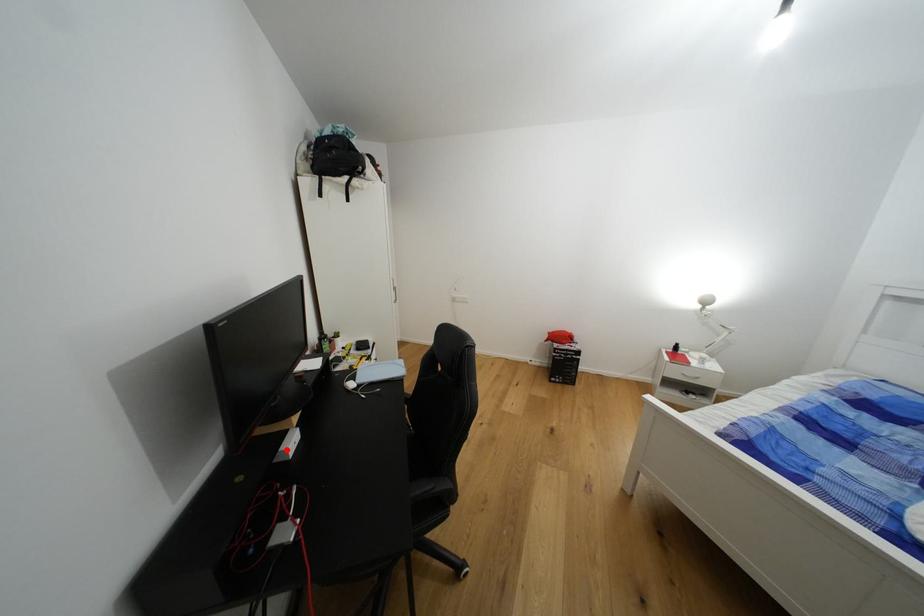
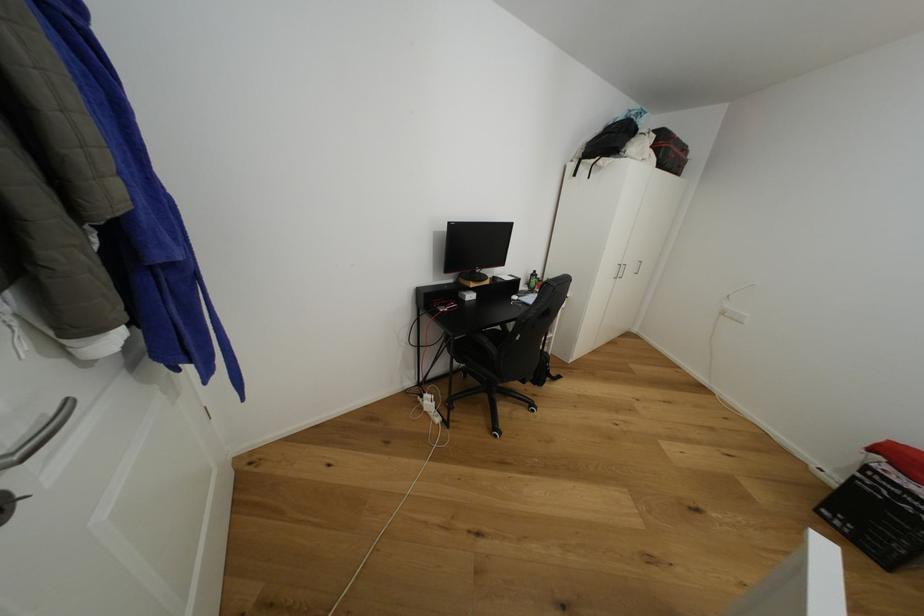
Locate, in the second image, the point that corresponds to the highlighted location in the first image.

(469, 294)